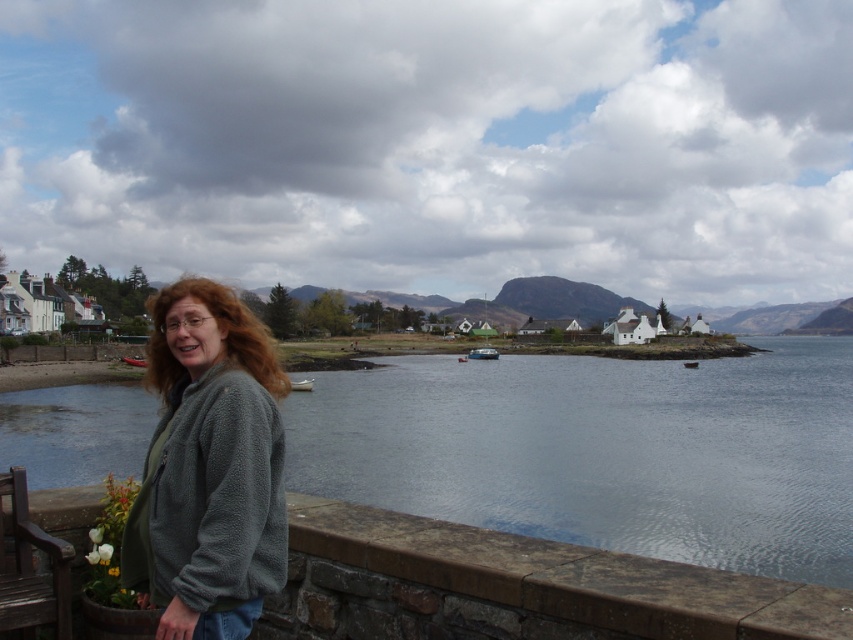
You are a photographer planning to take a wide shot of the clear water at lower left and the wooden park bench at lower left. Your camera can capture a maximum distance of 50 meters between subjects. Will you be able to include both in the same frame?

The distance between the clear water at lower left and the wooden park bench at lower left is 60.46 meters, which exceeds the camera maximum distance of 50 meters. Therefore, you cannot include both in the same frame.

You are standing at the edge of the water in the coastal scene. You want to place a 12 foot long fishing net horizontally between the clear water at lower left and the small wooden bench and potted plant with white flowers and green foliage to the left of the person. Is there enough space to do this without the net overlapping either object?

The clear water at lower left is 13.10 feet away from the viewer. Since the fishing net is 12 feet long, there is enough space to place it horizontally between the clear water at lower left and the small wooden bench and potted plant with white flowers and green foliage to the left of the person without overlapping either object.